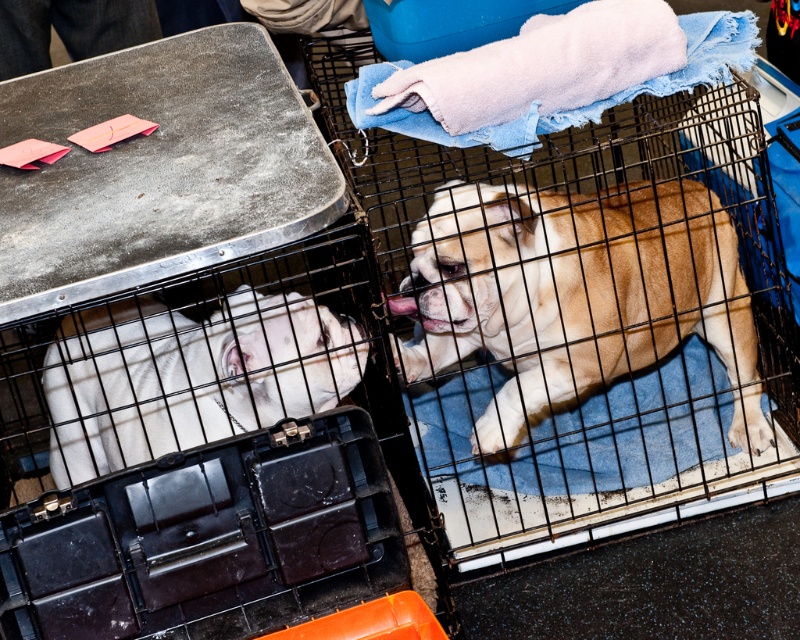
Question: Which point appears farthest from the camera in this image?

Choices:
 (A) (330, 365)
 (B) (598, 260)

Answer: (B)

Question: Which of the following is the farthest from the observer?

Choices:
 (A) light brown fur at center
 (B) white smooth dog at left

Answer: (A)

Question: Among these points, which one is farthest from the camera?

Choices:
 (A) (322, 358)
 (B) (560, 278)

Answer: (B)

Question: Is light brown fur at center wider than white smooth dog at left?

Choices:
 (A) no
 (B) yes

Answer: (B)

Question: Can you confirm if light brown fur at center is smaller than white smooth dog at left?

Choices:
 (A) yes
 (B) no

Answer: (B)

Question: Can you confirm if light brown fur at center is positioned above white smooth dog at left?

Choices:
 (A) no
 (B) yes

Answer: (B)